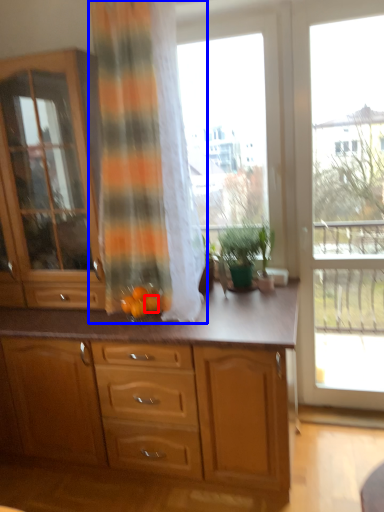
Question: Which point is closer to the camera, tangerine (highlighted by a red box) or curtain (highlighted by a blue box)?

Choices:
 (A) tangerine
 (B) curtain

Answer: (B)